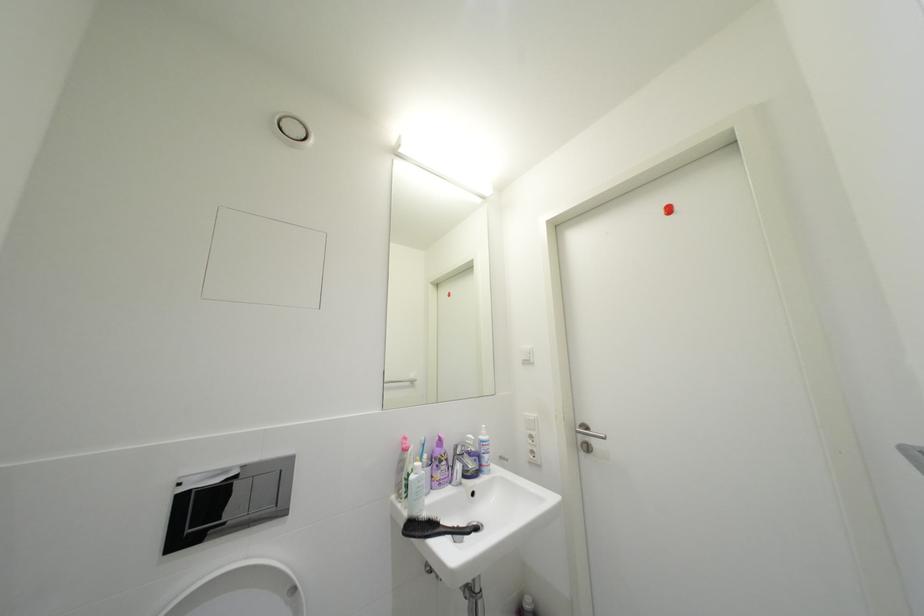
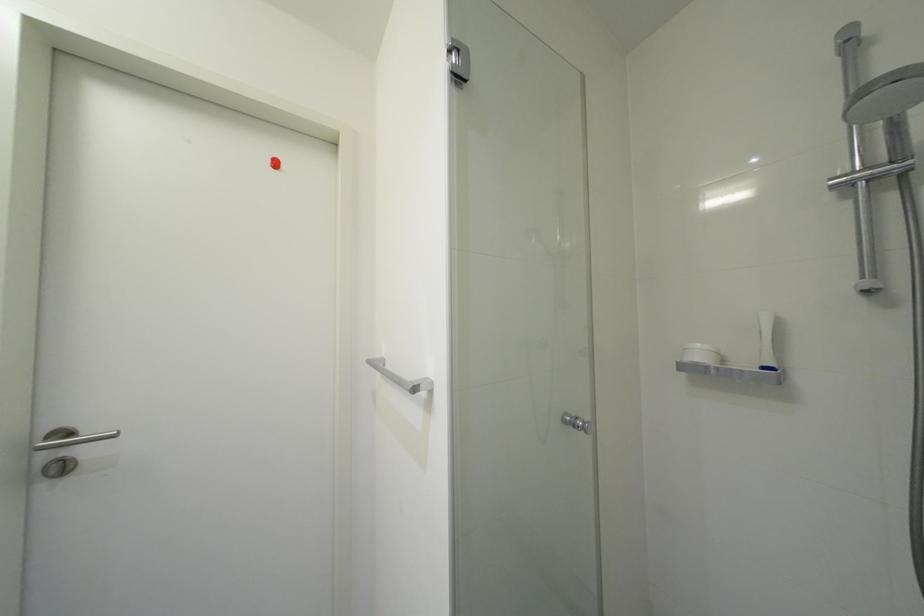
Question: Based on the continuous images, in which direction is the camera rotating? Reply with the corresponding letter.

Choices:
 (A) Left
 (B) Right
 (C) Up
 (D) Down

Answer: (B)